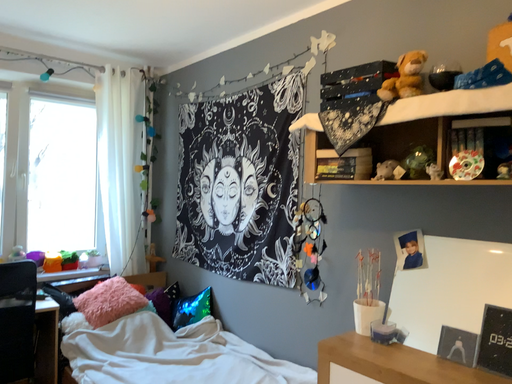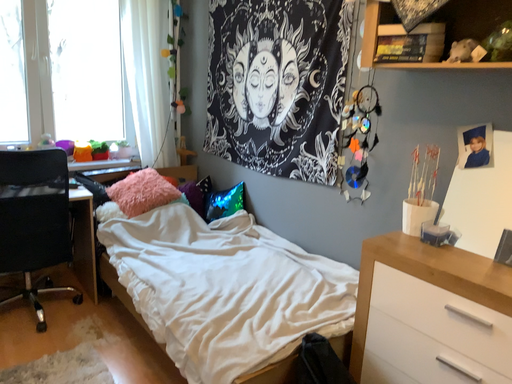
Question: How did the camera likely rotate when shooting the video?

Choices:
 (A) rotated downward
 (B) rotated upward

Answer: (A)